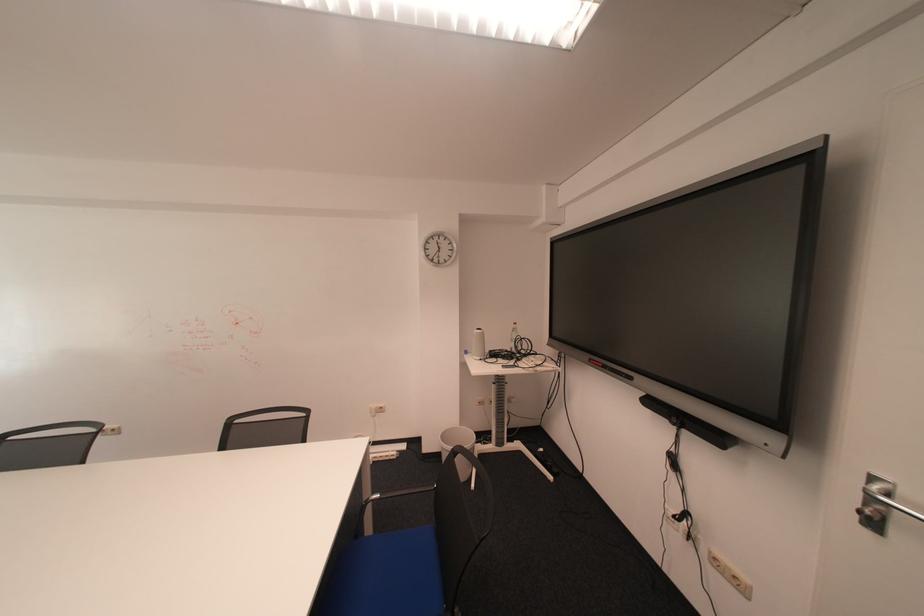
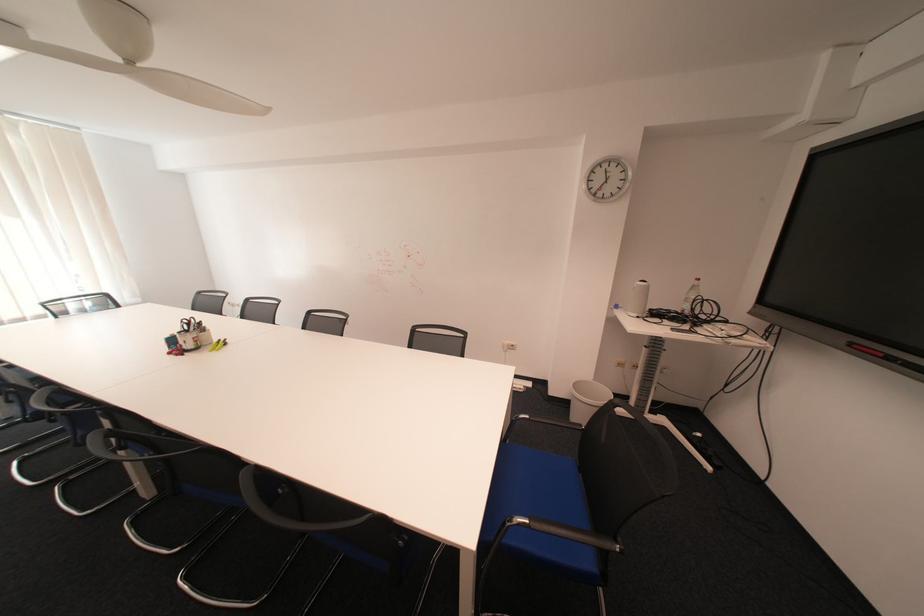
Question: In a continuous first-person perspective shot, in which direction is the camera moving?

Choices:
 (A) Left
 (B) Right
 (C) Forward
 (D) Backward

Answer: (A)